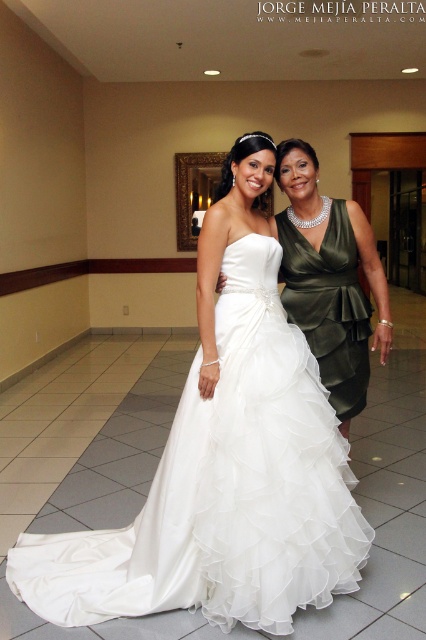
Question: Where is white satin dress at center located in relation to satin green dress at right in the image?

Choices:
 (A) left
 (B) right

Answer: (A)

Question: Is white satin dress at center below satin green dress at right?

Choices:
 (A) no
 (B) yes

Answer: (B)

Question: Which point is closer to the camera?

Choices:
 (A) (207, 253)
 (B) (331, 344)

Answer: (A)

Question: Does white satin dress at center have a larger size compared to satin green dress at right?

Choices:
 (A) no
 (B) yes

Answer: (B)

Question: Which object appears farthest from the camera in this image?

Choices:
 (A) satin green dress at right
 (B) white satin dress at center

Answer: (A)